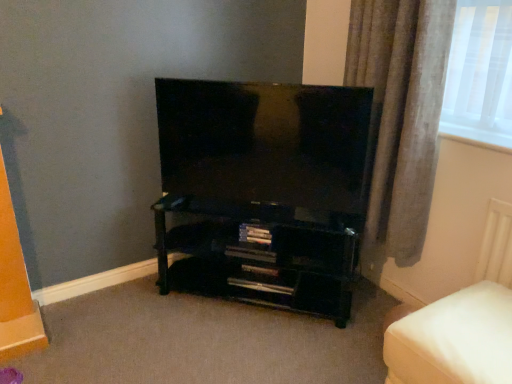
Question: Should I look upward or downward to see black glossy tv at center?

Choices:
 (A) down
 (B) up

Answer: (B)

Question: Is black glossy tv at center thinner than gray fabric curtain at right?

Choices:
 (A) no
 (B) yes

Answer: (B)

Question: Can you confirm if black glossy tv at center is shorter than gray fabric curtain at right?

Choices:
 (A) no
 (B) yes

Answer: (B)

Question: Does black glossy tv at center appear on the right side of gray fabric curtain at right?

Choices:
 (A) no
 (B) yes

Answer: (A)

Question: Is black glossy tv at center not near gray fabric curtain at right?

Choices:
 (A) yes
 (B) no

Answer: (B)

Question: Is black glossy tv at center in front of gray fabric curtain at right?

Choices:
 (A) yes
 (B) no

Answer: (B)

Question: Is black glossy tv at center touching gray fabric curtain at right?

Choices:
 (A) no
 (B) yes

Answer: (A)

Question: Is white fabric ottoman at lower right bigger than black glossy tv at center?

Choices:
 (A) yes
 (B) no

Answer: (A)

Question: Is white fabric ottoman at lower right not close to black glossy tv at center?

Choices:
 (A) no
 (B) yes

Answer: (A)

Question: Is white fabric ottoman at lower right turned away from black glossy tv at center?

Choices:
 (A) yes
 (B) no

Answer: (B)

Question: Is white fabric ottoman at lower right to the left of black glossy tv at center from the viewer's perspective?

Choices:
 (A) no
 (B) yes

Answer: (A)

Question: Can you confirm if white fabric ottoman at lower right is smaller than black glossy tv at center?

Choices:
 (A) no
 (B) yes

Answer: (A)

Question: Does white fabric ottoman at lower right appear on the right side of black glossy tv at center?

Choices:
 (A) yes
 (B) no

Answer: (A)

Question: Does black glossy shelf at lower center have a greater width compared to white fabric ottoman at lower right?

Choices:
 (A) no
 (B) yes

Answer: (A)